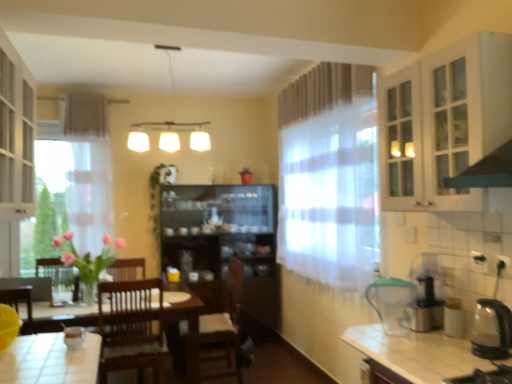
Question: Is white glass cabinet at upper right, which ranks as the third cabinetry in left-to-right order, with transparent glass kettle at right, which is counted as the first appliance, starting from the front?

Choices:
 (A) no
 (B) yes

Answer: (A)

Question: From the image's perspective, would you say white glass cabinet at upper right, the 1th cabinetry viewed from the right, is positioned over transparent glass kettle at right, the second appliance when ordered from left to right?

Choices:
 (A) yes
 (B) no

Answer: (A)

Question: From the image's perspective, is white glass cabinet at upper right, the 1th cabinetry viewed from the right, beneath transparent glass kettle at right, arranged as the second appliance when viewed from the back?

Choices:
 (A) yes
 (B) no

Answer: (B)

Question: Is white glass cabinet at upper right, which ranks as the third cabinetry in left-to-right order, in front of transparent glass kettle at right, the second appliance when ordered from left to right?

Choices:
 (A) yes
 (B) no

Answer: (A)

Question: Can you confirm if white glass cabinet at upper right, the 1th cabinetry viewed from the right, is bigger than transparent glass kettle at right, placed as the first appliance when sorted from right to left?

Choices:
 (A) no
 (B) yes

Answer: (B)

Question: Is white glass cabinet at upper right, which ranks as the third cabinetry in bottom-to-top order, not inside transparent glass kettle at right, the second appliance when ordered from left to right?

Choices:
 (A) yes
 (B) no

Answer: (A)

Question: Would you say translucent fabric curtain at center contains brown wooden chair at center?

Choices:
 (A) yes
 (B) no

Answer: (B)

Question: Does translucent fabric curtain at center have a lesser width compared to brown wooden chair at center?

Choices:
 (A) no
 (B) yes

Answer: (B)

Question: Could you tell me if translucent fabric curtain at center is turned towards brown wooden chair at center?

Choices:
 (A) yes
 (B) no

Answer: (B)

Question: Is translucent fabric curtain at center located outside brown wooden chair at center?

Choices:
 (A) yes
 (B) no

Answer: (A)

Question: Is translucent fabric curtain at center behind brown wooden chair at center?

Choices:
 (A) yes
 (B) no

Answer: (B)

Question: From the image's perspective, is translucent fabric curtain at center located beneath brown wooden chair at center?

Choices:
 (A) yes
 (B) no

Answer: (B)

Question: Is clear glass cabinet at upper right at the back of transparent glass kettle at right, the second appliance when ordered from left to right?

Choices:
 (A) no
 (B) yes

Answer: (A)